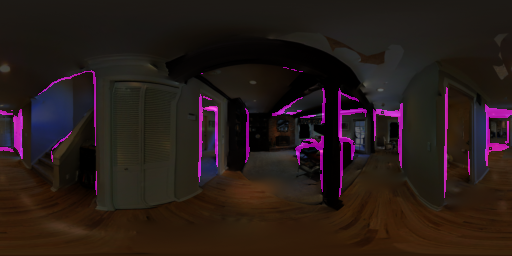
I want to click on light fixture, so click(x=4, y=69).